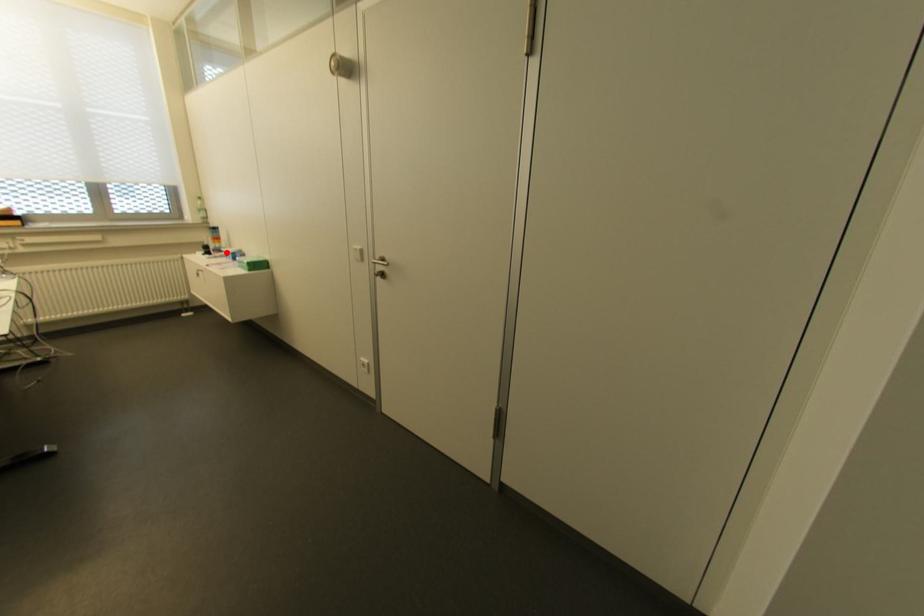
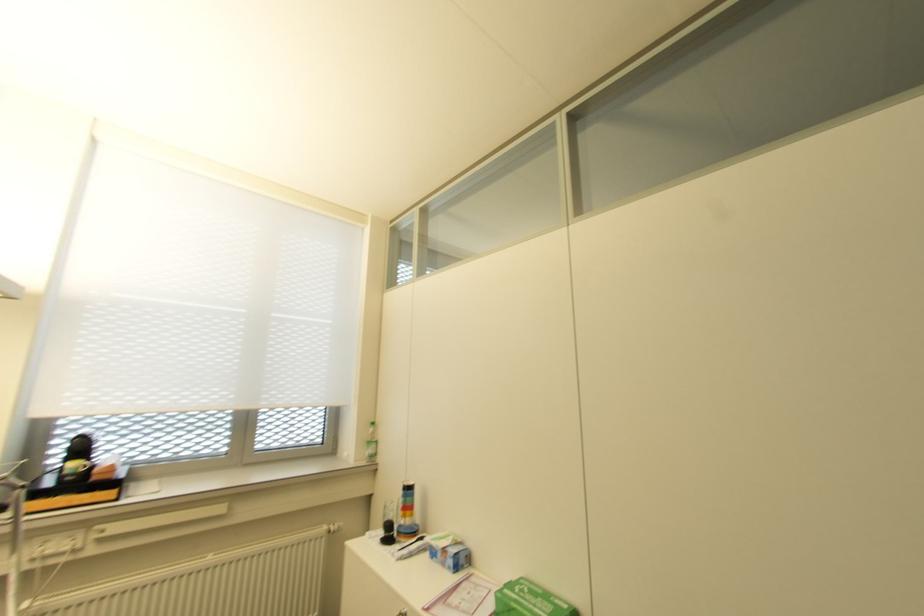
Where in the second image is the point corresponding to the highlighted location from the first image?

(441, 549)